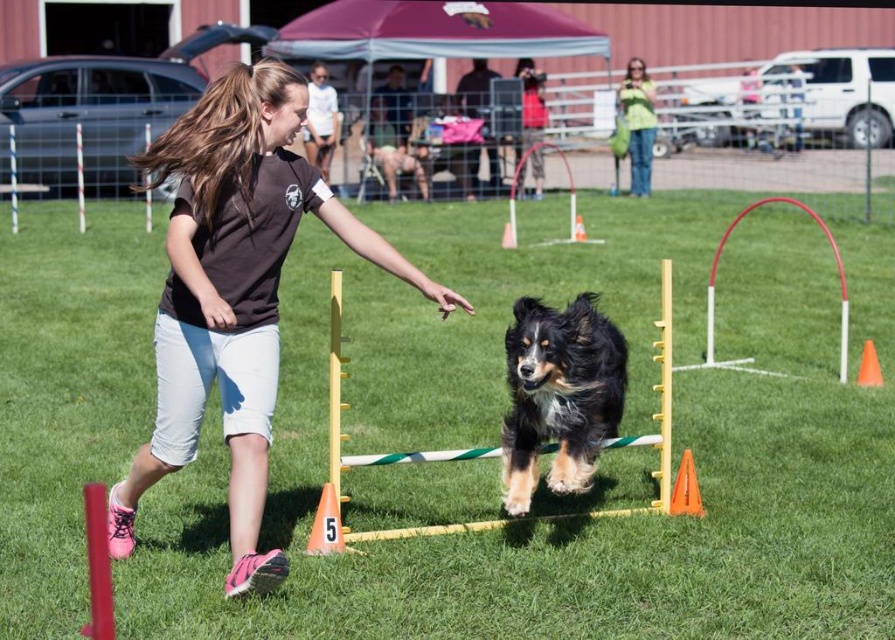
Question: Which object is closer to the camera taking this photo?

Choices:
 (A) yellow plastic hurdle at center
 (B) orange plastic cone at lower center
 (C) orange plastic cone at lower right

Answer: (A)

Question: Does matte black shirt at center appear on the right side of orange plastic cone at center?

Choices:
 (A) no
 (B) yes

Answer: (A)

Question: Which of these objects is positioned closest to the matte black shirt at center?

Choices:
 (A) yellow plastic hurdle at center
 (B) tri-colored fluffy dog at center
 (C) orange plastic cone at center
 (D) green textured jacket at upper right

Answer: (A)

Question: Does green textured jacket at upper right have a lesser width compared to orange plastic cone at lower right?

Choices:
 (A) yes
 (B) no

Answer: (B)

Question: Can you confirm if tri-colored fluffy dog at center is wider than orange plastic cone at center?

Choices:
 (A) yes
 (B) no

Answer: (A)

Question: Which of these objects is positioned closest to the orange plastic cone at lower center?

Choices:
 (A) orange plastic cone at lower right
 (B) tri-colored fluffy dog at center
 (C) green textured jacket at upper right
 (D) yellow plastic hurdle at center

Answer: (D)